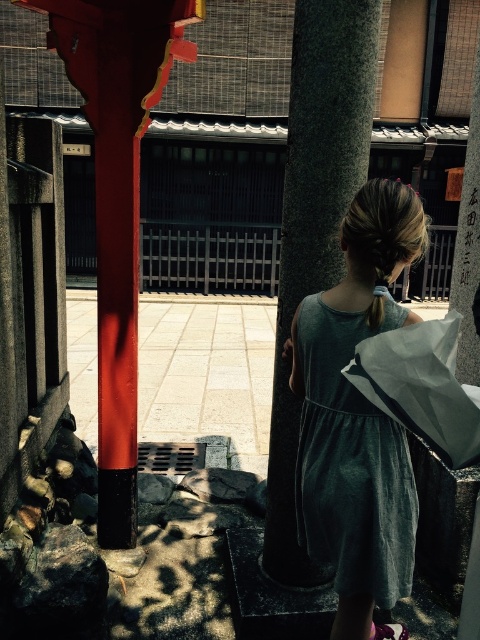
You are standing in a traditional Japanese courtyard and see a red pillar with intricate details at the top. There is a point marked at coordinates (118, 202). Based on the scene description, can you determine whether this point is located on the smooth red pole at the left side of the courtyard?

The point at coordinates (118, 202) is on the smooth red pole at left, as stated in the objects description.

You are a photographer wanting to capture both the smooth red pole at left and the velvet teal dress at center in a single frame. Based on their widths, which object should you position closer to the camera to ensure both fit within the shot?

The smooth red pole at left is wider than the velvet teal dress at center. To ensure both fit in the frame, position the wider smooth red pole at left closer to the camera so its width can be accommodated while keeping the velvet teal dress at center further back.

You are a tourist visiting a Japanese temple and notice the smooth red pole at left and the velvet teal dress at center. Which object takes up more space in the scene?

The smooth red pole at left is bigger than the velvet teal dress at center, so it takes up more space in the scene.